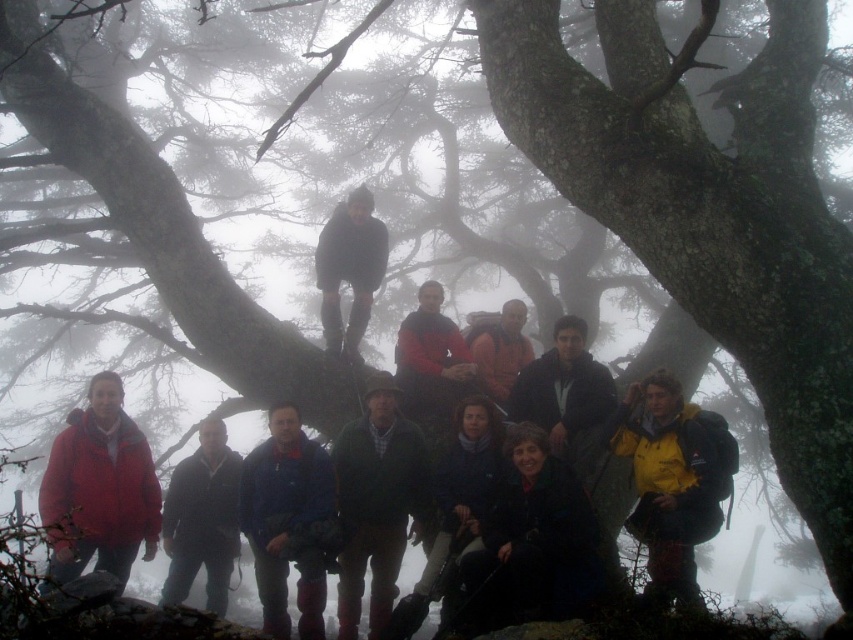
Question: Which point is closer to the camera taking this photo?

Choices:
 (A) (164, 540)
 (B) (489, 593)
 (C) (125, 552)

Answer: (B)

Question: Which object appears closest to the camera in this image?

Choices:
 (A) yellow matte jacket at lower right
 (B) matte red jacket at lower left
 (C) dark blue jacket at lower center
 (D) matte orange jacket at center

Answer: (B)

Question: Which is farther from the dark blue jacket at center?

Choices:
 (A) green plaid shirt at center
 (B) dark blue jacket at lower center

Answer: (B)

Question: Where is green plaid shirt at center located in relation to dark blue jacket at center in the image?

Choices:
 (A) right
 (B) left

Answer: (A)

Question: Does yellow matte jacket at lower right have a larger size compared to matte orange jacket at center?

Choices:
 (A) yes
 (B) no

Answer: (A)

Question: Does green plaid shirt at center appear on the right side of blue fleece jacket at center?

Choices:
 (A) no
 (B) yes

Answer: (B)